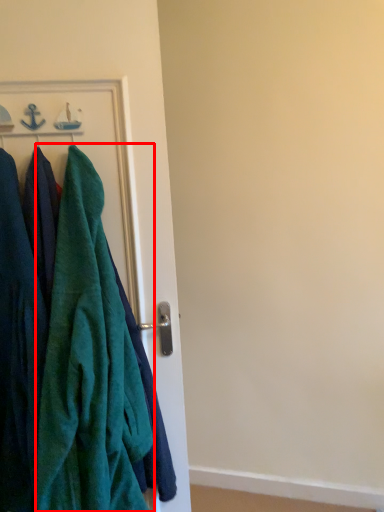
Question: From the image's perspective, where is towel (annotated by the red box) located relative to cloak?

Choices:
 (A) below
 (B) above

Answer: (A)